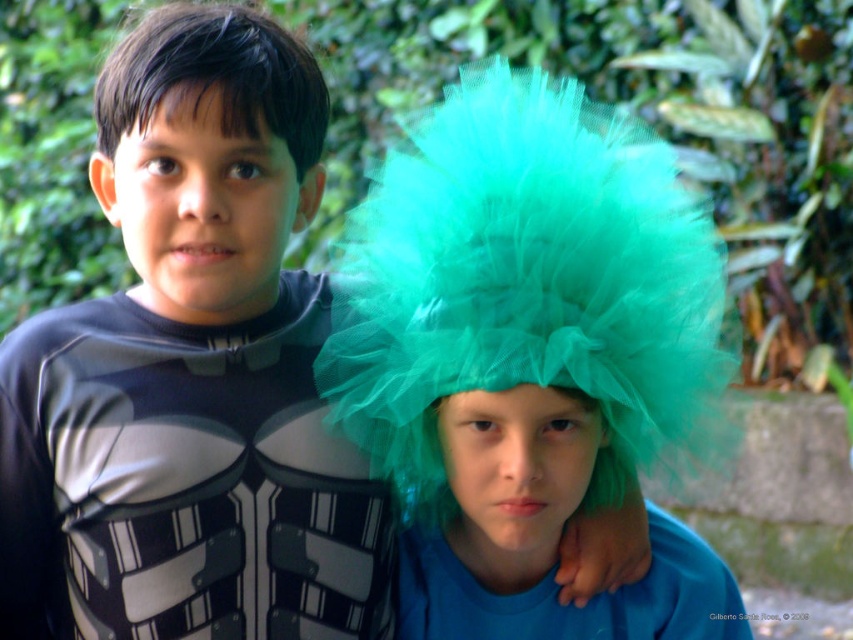
Question: Among these points, which one is nearest to the camera?

Choices:
 (A) (207, 81)
 (B) (427, 605)

Answer: (A)

Question: Does turquoise tulle wig at center appear on the right side of teal tulle wig at center?

Choices:
 (A) no
 (B) yes

Answer: (B)

Question: Considering the real-world distances, which object is farthest from the green tulle wig at upper center?

Choices:
 (A) teal tulle wig at center
 (B) turquoise tulle wig at center

Answer: (A)

Question: Which object is the closest to the teal tulle wig at center?

Choices:
 (A) turquoise tulle wig at center
 (B) green tulle wig at upper center

Answer: (A)

Question: Can you confirm if teal tulle wig at center is bigger than green tulle wig at upper center?

Choices:
 (A) yes
 (B) no

Answer: (A)

Question: Observing the image, what is the correct spatial positioning of turquoise tulle wig at center in reference to green tulle wig at upper center?

Choices:
 (A) left
 (B) right

Answer: (B)